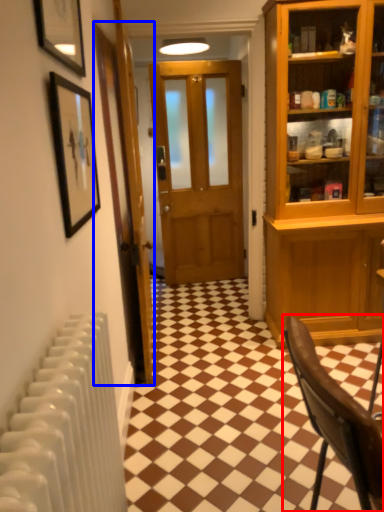
Question: Which point is closer to the camera, chair (highlighted by a red box) or door (highlighted by a blue box)?

Choices:
 (A) chair
 (B) door

Answer: (A)